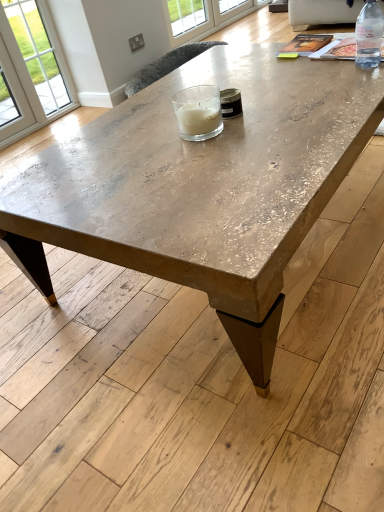
Find the location of `free spot in front of clear plastic bottle at upper right`. free spot in front of clear plastic bottle at upper right is located at coordinates (361, 80).